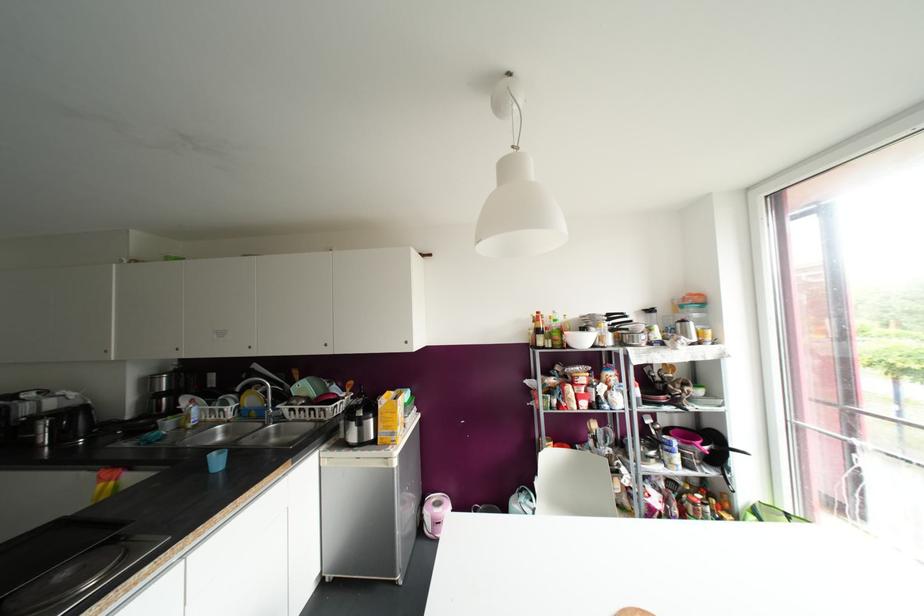
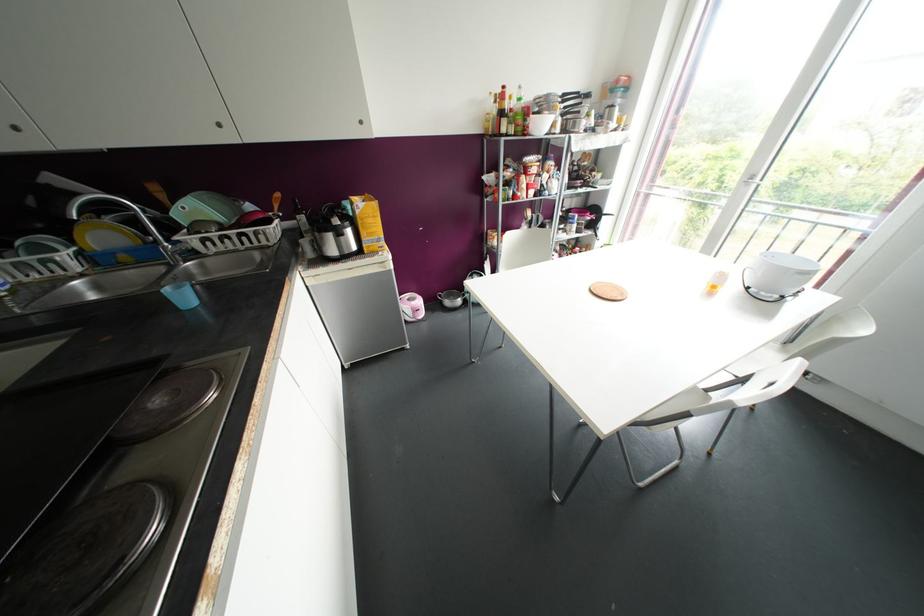
Locate, in the second image, the point that corresponds to pixel 406 342 in the first image.

(360, 122)